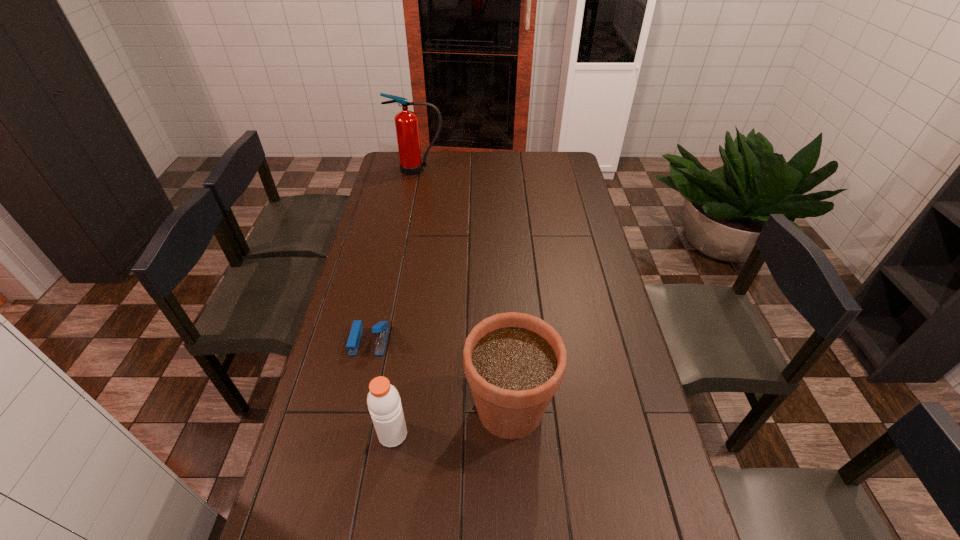
Where is `object that is positioned at the far edge`? The width and height of the screenshot is (960, 540). object that is positioned at the far edge is located at coordinates (406, 122).

I want to click on fire extinguisher at the left edge, so click(406, 122).

You are a GUI agent. You are given a task and a screenshot of the screen. Output one action in this format:
    pyautogui.click(x=<x>, y=<y>)
    Task: Click on the stapler that is positioned at the left edge
    
    Given the screenshot: What is the action you would take?
    pyautogui.click(x=381, y=328)

Locate an element on the screen. object located at the far left corner is located at coordinates (406, 122).

In the image, there is a desktop. Where is `vacant space at the far edge`? vacant space at the far edge is located at coordinates (443, 175).

Where is `vacant space at the left edge of the desktop`? This screenshot has width=960, height=540. vacant space at the left edge of the desktop is located at coordinates (376, 284).

In the image, there is a desktop. Where is `vacant space at the right edge`? The height and width of the screenshot is (540, 960). vacant space at the right edge is located at coordinates (644, 455).

Locate an element on the screen. vacant space at the far left corner of the desktop is located at coordinates (386, 172).

This screenshot has height=540, width=960. I want to click on free area in between the rightmost object and the shortest object, so click(440, 375).

Where is `vacant area between the shaker and the flowerpot`? This screenshot has height=540, width=960. vacant area between the shaker and the flowerpot is located at coordinates click(x=451, y=421).